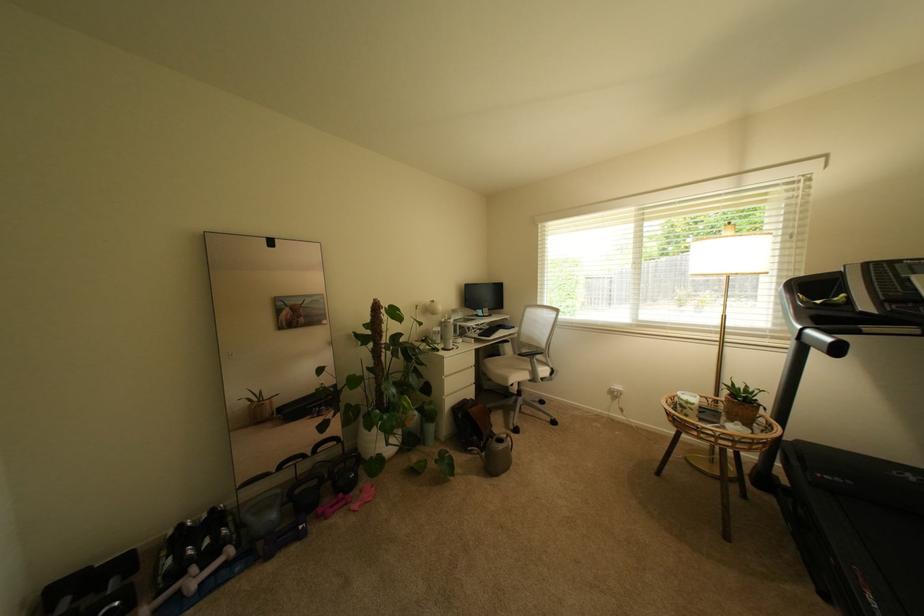
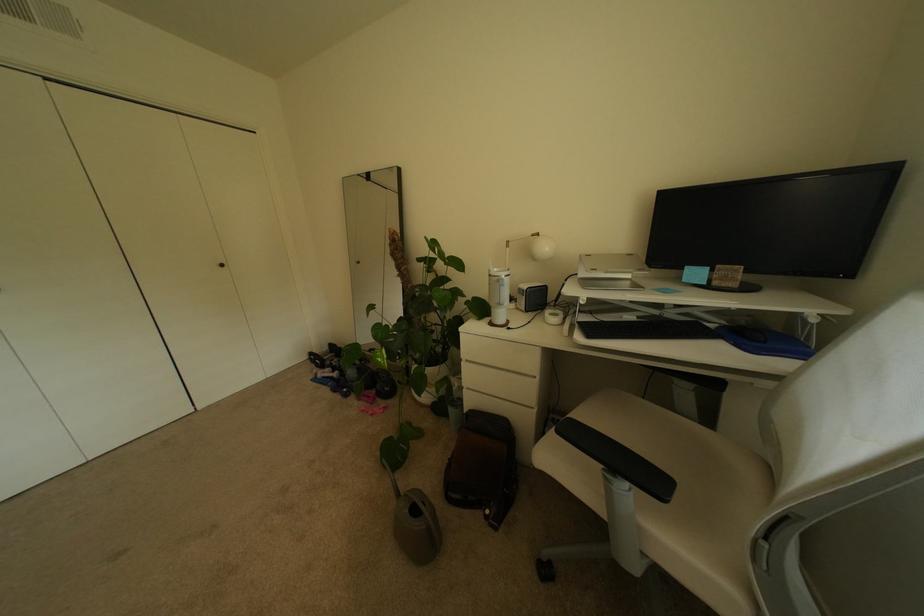
Find the pixel in the second image that matches the point at 470,321 in the first image.

(637, 284)